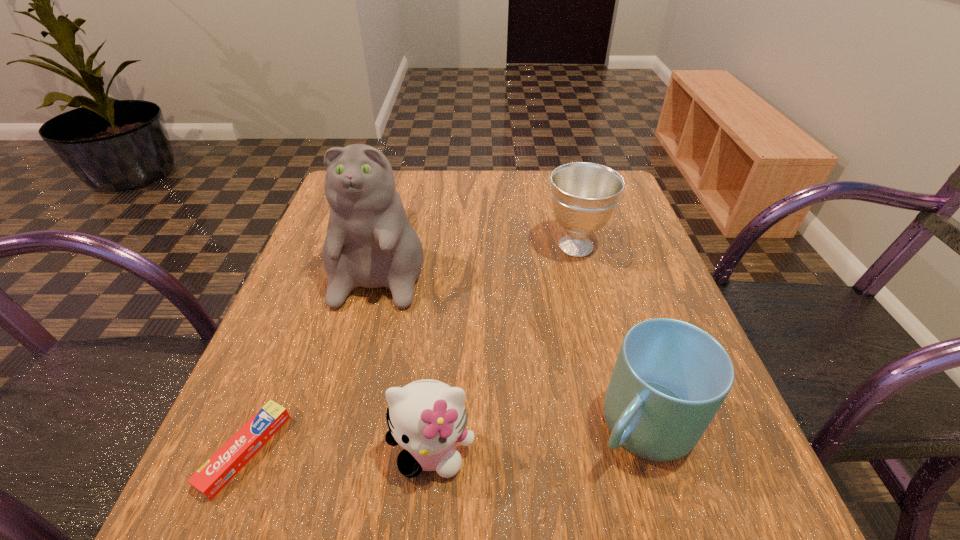
Where is `cat`? cat is located at coordinates (370, 243).

In order to click on chalice in this screenshot , I will do `click(584, 195)`.

The width and height of the screenshot is (960, 540). I want to click on mug, so click(x=670, y=378).

Identify the location of kitten. The width and height of the screenshot is (960, 540). (427, 417).

Find the location of `the shortest object`. the shortest object is located at coordinates (213, 476).

Where is `vacant space located 0.350m on the face of the tallest object`? vacant space located 0.350m on the face of the tallest object is located at coordinates (319, 504).

At what (x,y) coordinates should I click in order to perform the action: click on vacant space located on the back of the chalice. Please return your answer as a coordinate pair (x, y). Looking at the image, I should click on (567, 213).

At what (x,y) coordinates should I click in order to perform the action: click on free space located on the back of the mug. Please return your answer as a coordinate pair (x, y). The image size is (960, 540). Looking at the image, I should click on (609, 312).

I want to click on vacant space located on the front-facing side of the kitten, so click(x=424, y=532).

Identify the location of vacant space located 0.150m on the back of the shortest object. (293, 335).